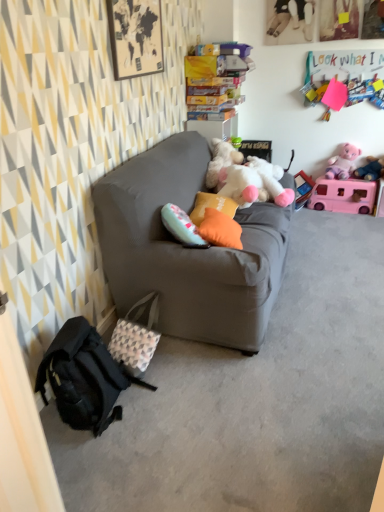
Locate an element on the screen. vacant area that lies between matte gray couch at center and black fabric backpack at lower left is located at coordinates (188, 389).